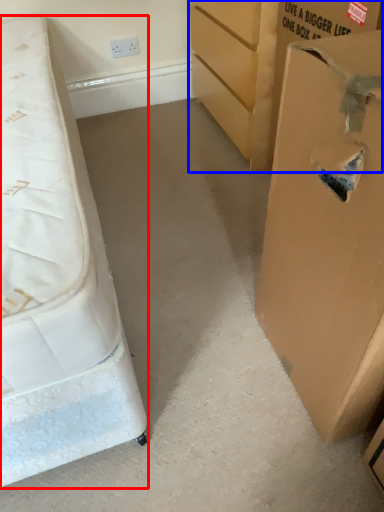
Question: Among these objects, which one is farthest to the camera, bed (highlighted by a red box) or cardboard box (highlighted by a blue box)?

Choices:
 (A) bed
 (B) cardboard box

Answer: (B)